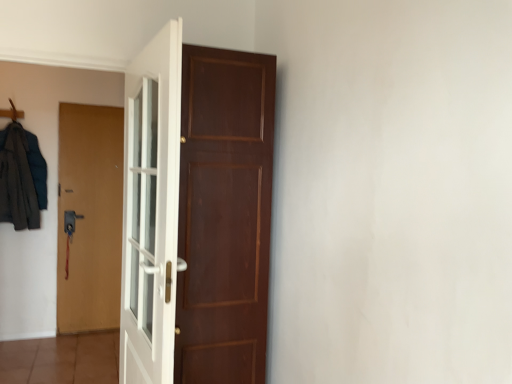
Question: Is wooden hanger at upper left taller or shorter than white glossy door at center, arranged as the third door when viewed from the back?

Choices:
 (A) tall
 (B) short

Answer: (B)

Question: From a real-world perspective, is wooden hanger at upper left above or below white glossy door at center, arranged as the third door when viewed from the back?

Choices:
 (A) above
 (B) below

Answer: (A)

Question: Which is nearer to the white glossy door at center, which appears as the first door when viewed from the front?

Choices:
 (A) dark gray fabric coat at left
 (B) brown matte door at left, acting as the third door starting from the right
 (C) brown wooden door at center, marked as the third door in a left-to-right arrangement
 (D) wooden hanger at upper left

Answer: (C)

Question: Based on their relative distances, which object is farther from the white glossy door at center, which appears as the first door when viewed from the front?

Choices:
 (A) brown wooden door at center, the 2th door viewed from the front
 (B) dark gray fabric coat at left
 (C) brown matte door at left, which is the third door from front to back
 (D) wooden hanger at upper left

Answer: (D)